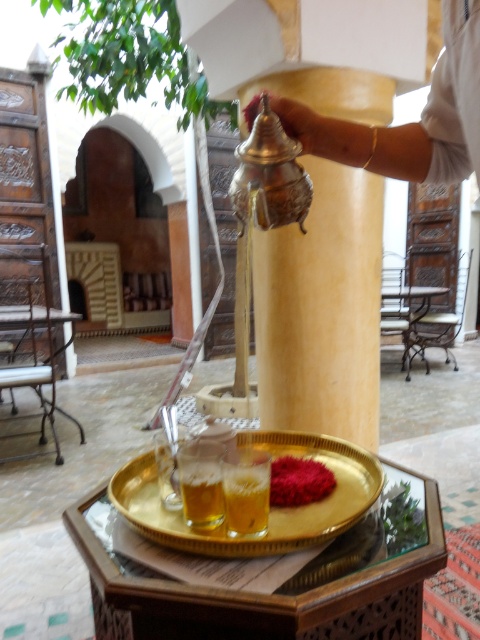
Question: Where is metallic gold pillar at center located in relation to gold metallic tray at center in the image?

Choices:
 (A) below
 (B) above

Answer: (B)

Question: Is metallic gold pillar at center to the right of gold metallic tray at center from the viewer's perspective?

Choices:
 (A) no
 (B) yes

Answer: (B)

Question: Is gold metallic tray at center further to the viewer compared to translucent glass beverage at center?

Choices:
 (A) yes
 (B) no

Answer: (B)

Question: Based on their relative distances, which object is farther from the translucent glass beverage at center?

Choices:
 (A) metallic gold pillar at center
 (B) smooth red powder at center
 (C) gold metallic tray at center

Answer: (A)

Question: Estimate the real-world distances between objects in this image. Which object is closer to the metallic gold pillar at center?

Choices:
 (A) translucent glass beverage at center
 (B) smooth red powder at center

Answer: (B)

Question: Which object appears closest to the camera in this image?

Choices:
 (A) smooth red powder at center
 (B) metallic gold pillar at center
 (C) gold metallic tray at center

Answer: (C)